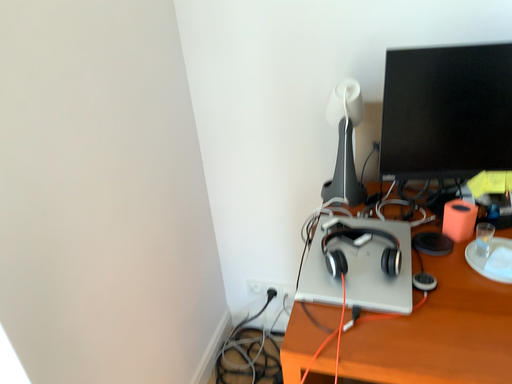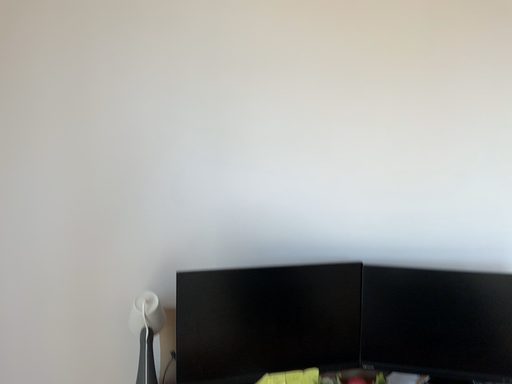
Question: How did the camera likely rotate when shooting the video?

Choices:
 (A) rotated upward
 (B) rotated downward

Answer: (A)